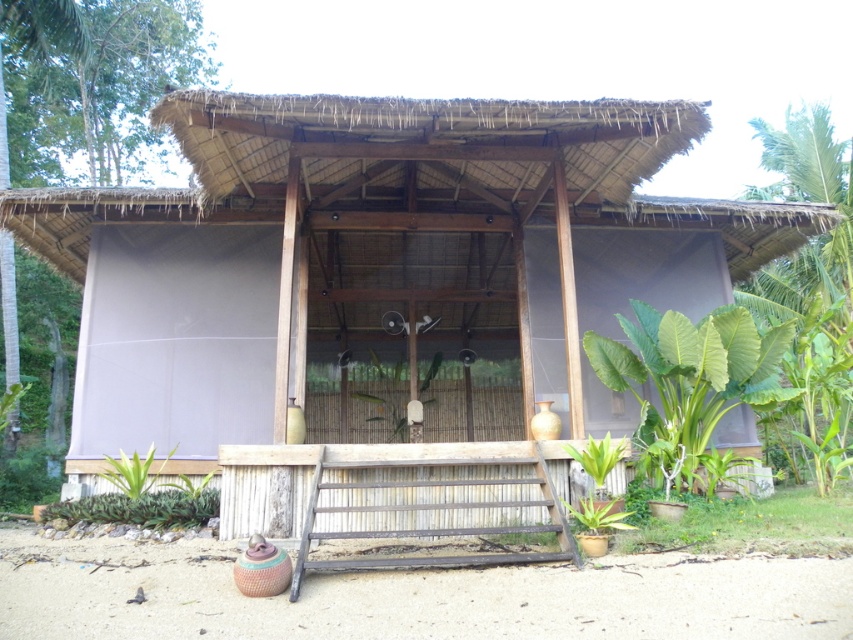
Is wooden hut at center wider than green leafy plant at lower left?

Correct, the width of wooden hut at center exceeds that of green leafy plant at lower left.

Can you confirm if wooden hut at center is smaller than green leafy plant at lower left?

Incorrect, wooden hut at center is not smaller in size than green leafy plant at lower left.

Measure the distance between point (486,124) and camera.

Point (486,124) and camera are 6.96 meters apart.

You are a GUI agent. You are given a task and a screenshot of the screen. Output one action in this format:
    pyautogui.click(x=<x>, y=<y>)
    Task: Click on the wooden hut at center
    Image resolution: width=853 pixels, height=640 pixels.
    Given the screenshot: What is the action you would take?
    pyautogui.click(x=381, y=266)

Is point (624, 378) more distant than point (100, 493)?

Yes, point (624, 378) is behind point (100, 493).

This screenshot has width=853, height=640. I want to click on green leafy plant at right, so click(692, 372).

Between point (689, 310) and point (659, 333), which one is positioned behind?

The point (689, 310) is more distant.

This screenshot has width=853, height=640. What are the coordinates of `wooden hut at center` in the screenshot? It's located at (381, 266).